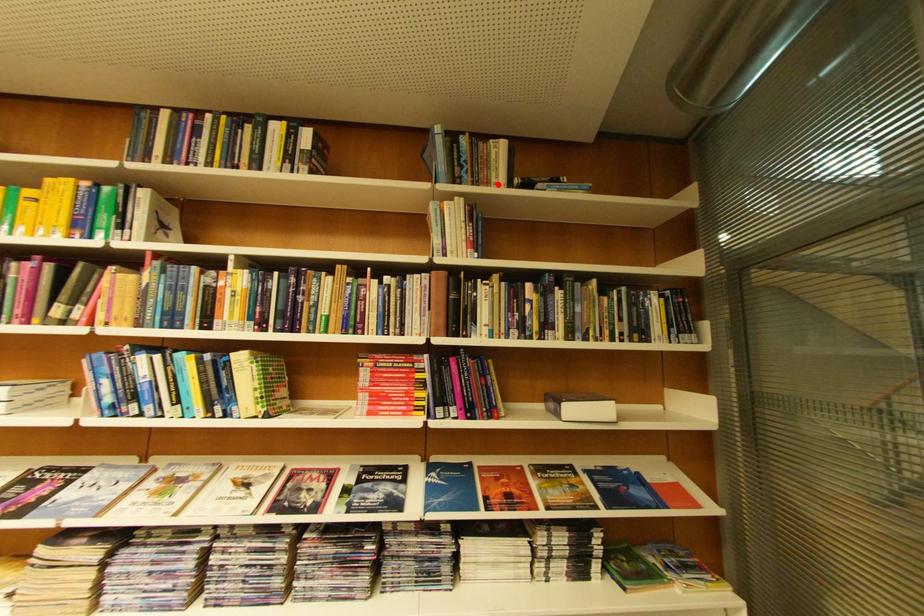
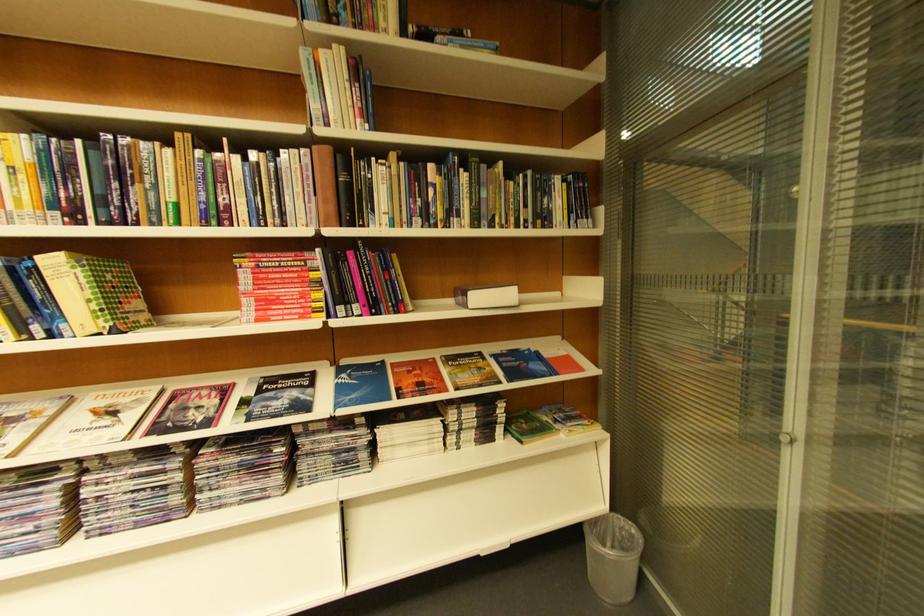
The point at the highlighted location is marked in the first image. Where is the corresponding point in the second image?

(384, 31)